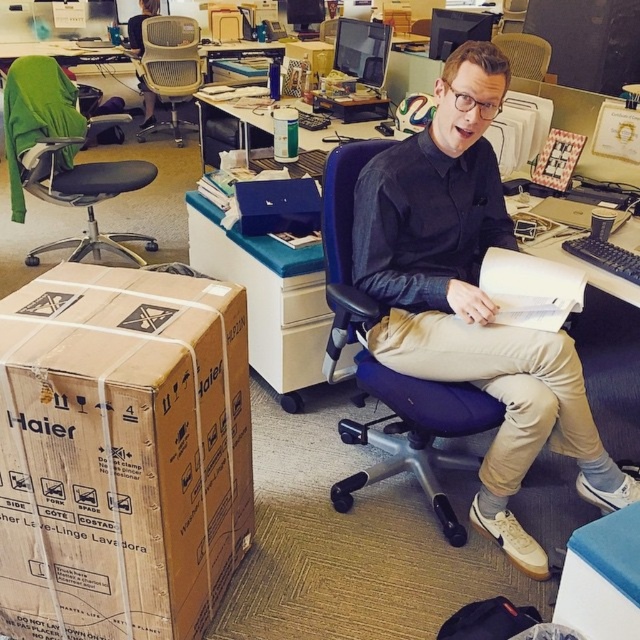
Question: Which object appears closest to the camera in this image?

Choices:
 (A) brown cardboard box at lower left
 (B) metallic mesh chair at upper center
 (C) green fabric swivel chair at upper left

Answer: (A)

Question: Where is brown cardboard box at lower left located in relation to matte black shirt at center in the image?

Choices:
 (A) left
 (B) right

Answer: (A)

Question: Which object is closer to the camera taking this photo?

Choices:
 (A) metallic mesh chair at upper center
 (B) light beige mesh office chair at upper left
 (C) matte black shirt at center

Answer: (C)

Question: Which object is closer to the camera taking this photo?

Choices:
 (A) light beige mesh office chair at upper left
 (B) metallic mesh chair at upper center
 (C) blue fabric office chair at center
 (D) matte black shirt at center

Answer: (D)

Question: Can you confirm if green fabric swivel chair at upper left is bigger than metallic mesh chair at upper center?

Choices:
 (A) no
 (B) yes

Answer: (B)

Question: Can you confirm if matte black shirt at center is positioned to the left of metallic mesh chair at upper center?

Choices:
 (A) yes
 (B) no

Answer: (A)